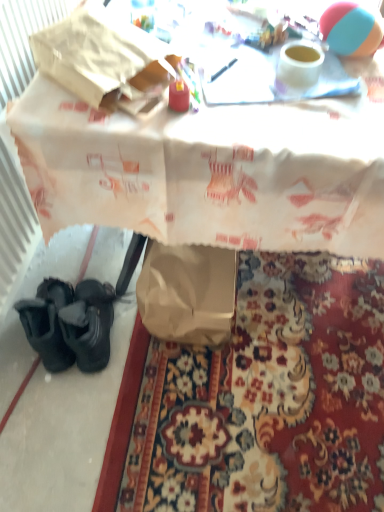
You are a GUI agent. You are given a task and a screenshot of the screen. Output one action in this format:
    pyautogui.click(x=<x>, y=<y>)
    Task: Click on the vacant space situated above brown paper bag at lower left (from a real-world perspective)
    
    Given the screenshot: What is the action you would take?
    pyautogui.click(x=228, y=414)